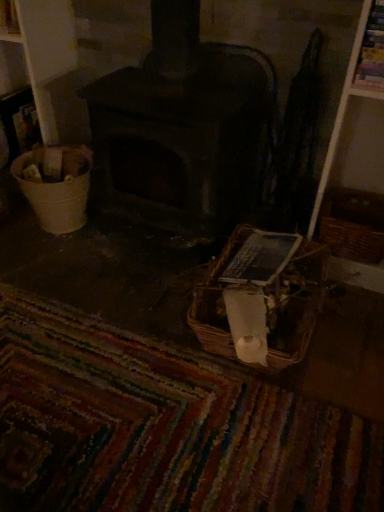
Identify the location of empty space that is ontop of woven brown basket at lower center, which is the 2th basket from right to left (from a real-world perspective). The image size is (384, 512). (258, 272).